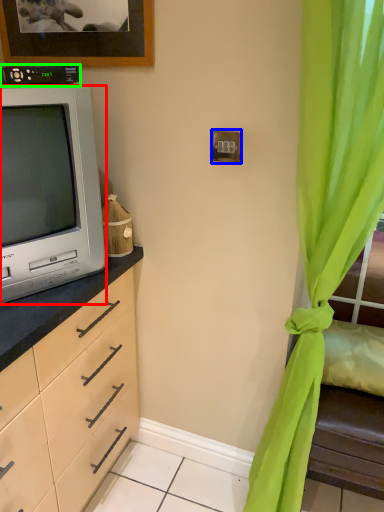
Question: Which object is the farthest from television (highlighted by a red box)? Choose among these: electric outlet (highlighted by a blue box) or appliance (highlighted by a green box).

Choices:
 (A) electric outlet
 (B) appliance

Answer: (A)